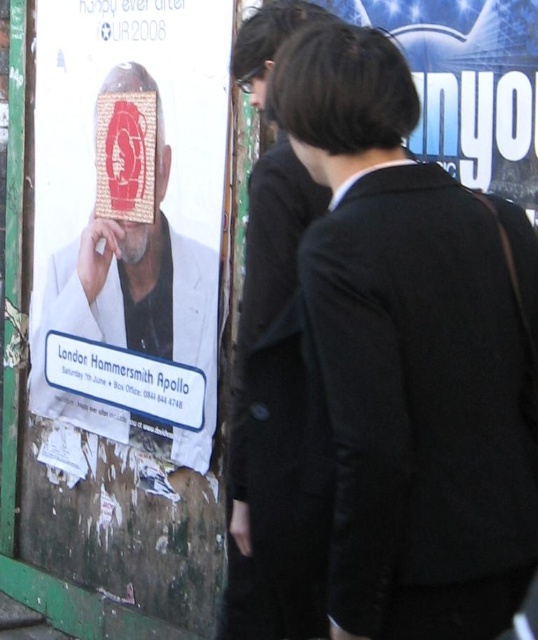
You are standing in front of a wall with a poster and two people. The poster is at point (123,221). If you want to reach the two people to your right, which direction should you turn?

Since the white paper poster at left is located at point (123,221), the two people to your right are likely on your right side. Therefore, you should turn to your right to reach them.

You are a fashion designer observing the weathered wall with posters and two items of clothing. You need to choose between the black woolen coat at center and the matte black suit at center for a client who prefers larger garments. Which item would you recommend?

The black woolen coat at center is bigger than the matte black suit at center, so it would be the better choice for the client who prefers larger garments.